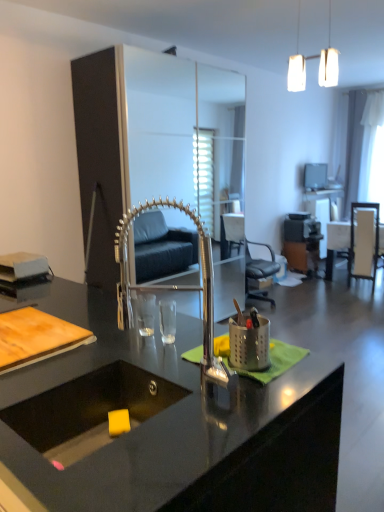
What are the coordinates of `free space in front of polished chrome faucet at center` in the screenshot? It's located at (180, 434).